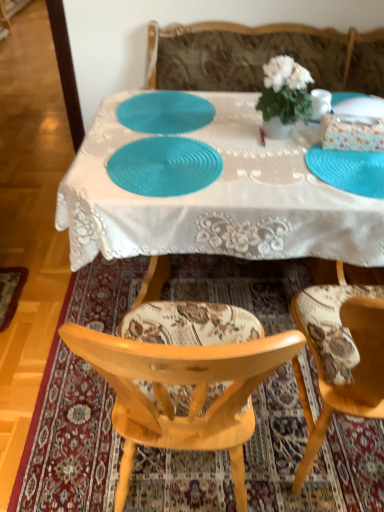
Identify the location of vacant region below teal textured plate at center, acting as the second plate starting from the right (from a real-world perspective). (162, 167).